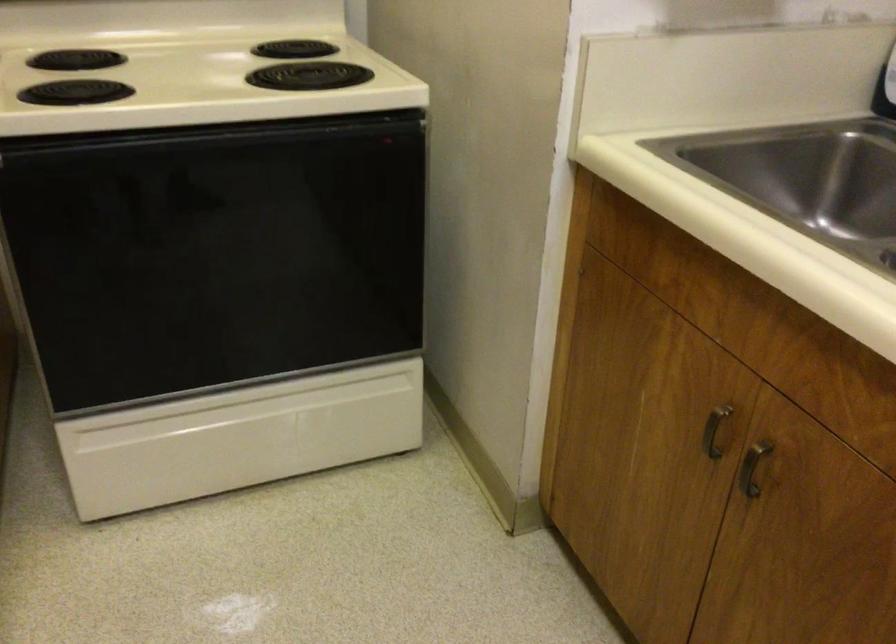
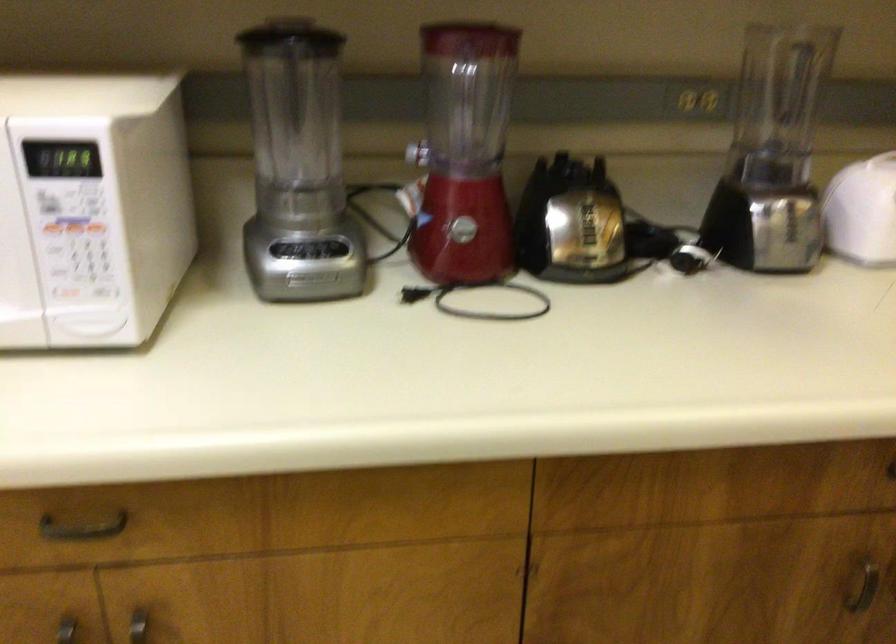
Based on the continuous images, in which direction is the camera rotating?

The camera rotated toward left-down.